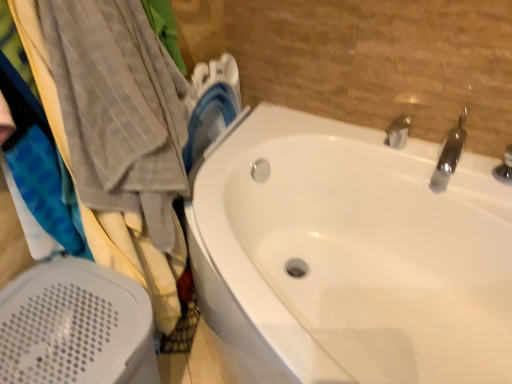
You are a GUI agent. You are given a task and a screenshot of the screen. Output one action in this format:
    pyautogui.click(x=<x>, y=<y>)
    Task: Click on the vacant area situated to the left side of silver metallic tap at upper right, the 2th tap in the right-to-left sequence
    The image size is (512, 384).
    Given the screenshot: What is the action you would take?
    pyautogui.click(x=344, y=136)